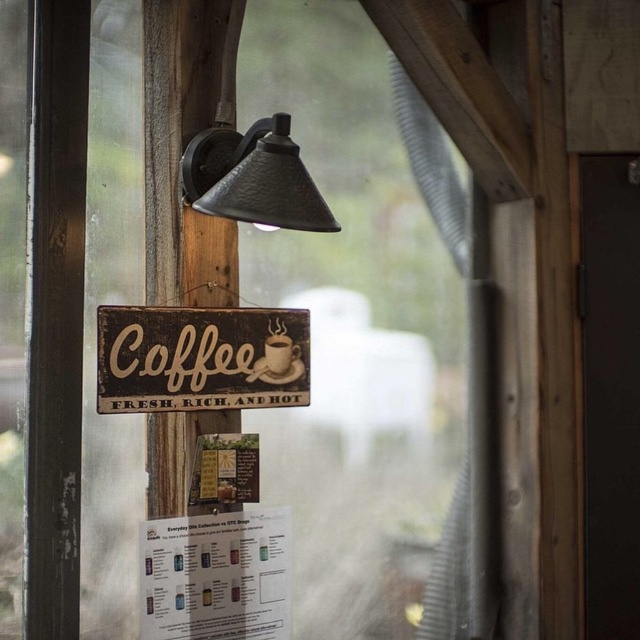
You are standing in front of the wooden sign that says Coffee. There are two points marked on the sign, one at coordinates point (310, 205) and another at point (291, 356). Which point is closer to you?

Point (310, 205) is closer to the viewer than point (291, 356).

You are a barista who needs to place a new menu board between the matte black lamp at upper center and the matte ceramic mug at center. The menu board is 25 centimeters wide. Is there enough space between them to fit the menu board?

The matte black lamp at upper center is 27.19 centimeters from the matte ceramic mug at center. Since the menu board is 25 centimeters wide, there is enough space between them to fit the menu board.